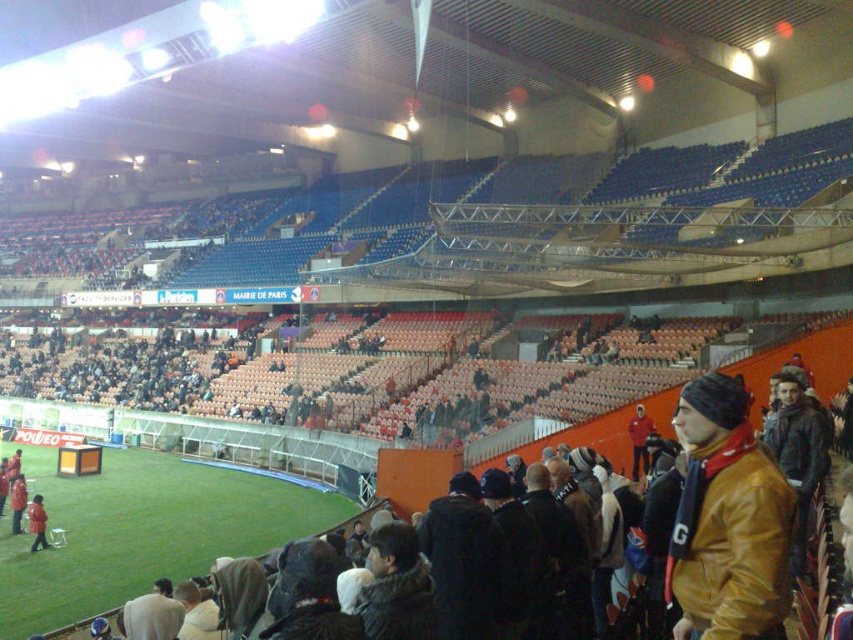
Question: Based on their relative distances, which object is farther from the brown leather jacket at lower right?

Choices:
 (A) red fabric jacket at right
 (B) red leather jacket at lower left
 (C) orange fabric jacket at lower left

Answer: (B)

Question: Which object is the farthest from the red leather jacket at lower left?

Choices:
 (A) orange fabric jacket at lower left
 (B) brown leather jacket at lower right

Answer: (B)

Question: In this image, where is brown leather jacket at lower right located relative to red fabric jacket at right?

Choices:
 (A) below
 (B) above

Answer: (B)

Question: Can you confirm if brown leather jacket at lower right is thinner than orange fabric jacket at lower left?

Choices:
 (A) yes
 (B) no

Answer: (B)

Question: Is brown leather jacket at lower right bigger than orange fabric jacket at lower left?

Choices:
 (A) no
 (B) yes

Answer: (B)

Question: Among these points, which one is farthest from the camera?

Choices:
 (A) (635, 406)
 (B) (28, 515)
 (C) (741, 486)
 (D) (16, 524)

Answer: (A)